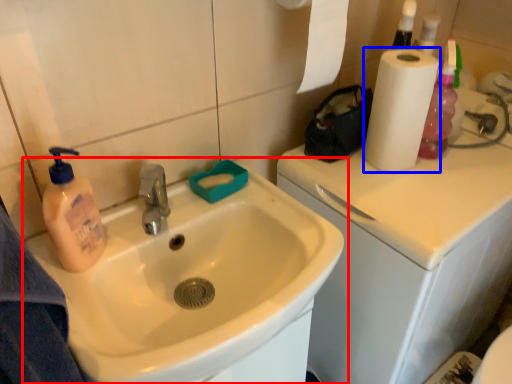
Question: Which point is closer to the camera, sink (highlighted by a red box) or paper towel (highlighted by a blue box)?

Choices:
 (A) sink
 (B) paper towel

Answer: (A)